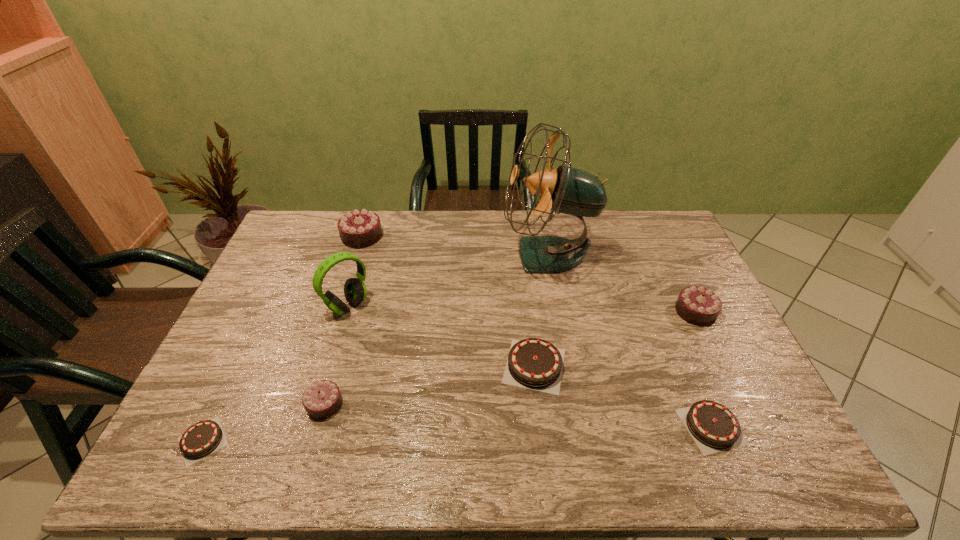
The image size is (960, 540). What are the coordinates of `the tallest object` in the screenshot? It's located at (567, 190).

Identify the location of fan. (567, 190).

Where is `green headset`? The height and width of the screenshot is (540, 960). green headset is located at coordinates (355, 291).

Identify the location of the second tallest object. This screenshot has width=960, height=540. (355, 291).

I want to click on the farthest chocolate chocolate cake, so click(x=362, y=228).

The image size is (960, 540). I want to click on the farthest chocolate cake, so click(x=362, y=228).

This screenshot has height=540, width=960. What are the coordinates of `the fifth shortest chocolate cake` in the screenshot? It's located at (699, 306).

At what (x,y) coordinates should I click in order to perform the action: click on the fourth tallest object. Please return your answer as a coordinate pair (x, y). Image resolution: width=960 pixels, height=540 pixels. Looking at the image, I should click on (699, 306).

At what (x,y) coordinates should I click in order to perform the action: click on the nearest chocolate chocolate cake. Please return your answer as a coordinate pair (x, y). The width and height of the screenshot is (960, 540). Looking at the image, I should click on (322, 399).

At what (x,y) coordinates should I click in order to perform the action: click on the second brown chocolate cake from left to right. Please return your answer as a coordinate pair (x, y). This screenshot has height=540, width=960. Looking at the image, I should click on (533, 363).